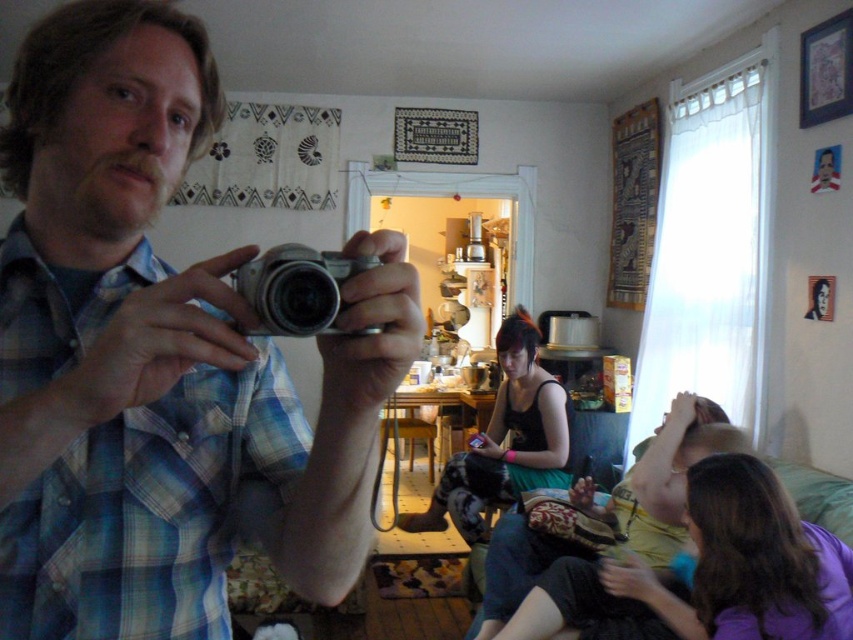
Question: Does matte silver camera at center have a lesser width compared to purple matte shirt at lower right?

Choices:
 (A) yes
 (B) no

Answer: (A)

Question: Is matte silver camera at center positioned before purple matte shirt at lower right?

Choices:
 (A) yes
 (B) no

Answer: (A)

Question: Does purple matte shirt at lower right have a larger size compared to silver metallic camera at center?

Choices:
 (A) no
 (B) yes

Answer: (B)

Question: Which object is positioned closest to the matte silver camera at center?

Choices:
 (A) silver metallic camera at center
 (B) purple matte shirt at lower right
 (C) matte green dress at center
 (D) matte black tank top at center

Answer: (A)

Question: Which of the following is the closest to the observer?

Choices:
 (A) matte black tank top at center
 (B) purple matte shirt at lower right
 (C) silver metallic camera at center
 (D) matte silver camera at center

Answer: (C)

Question: Which of the following is the farthest from the observer?

Choices:
 (A) (807, 582)
 (B) (39, 563)

Answer: (A)